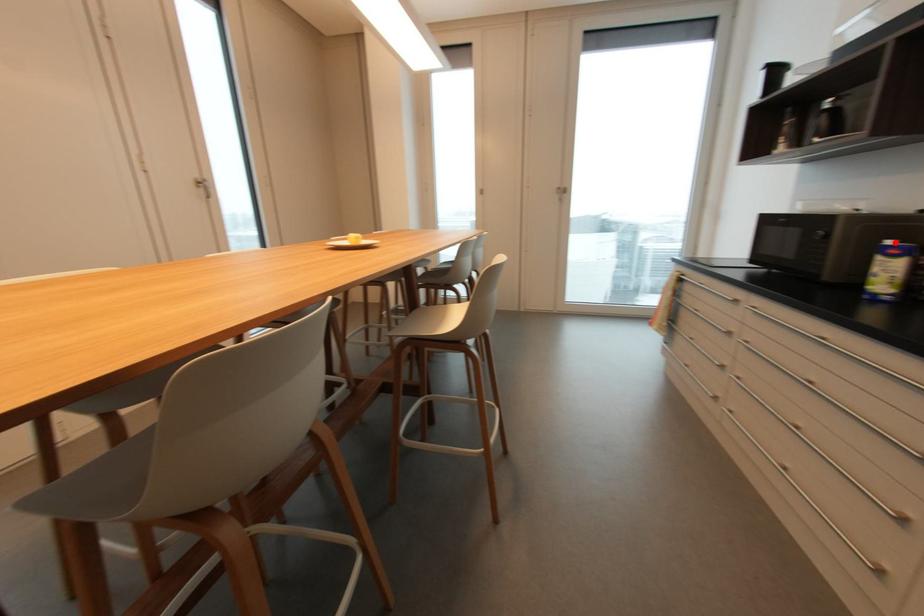
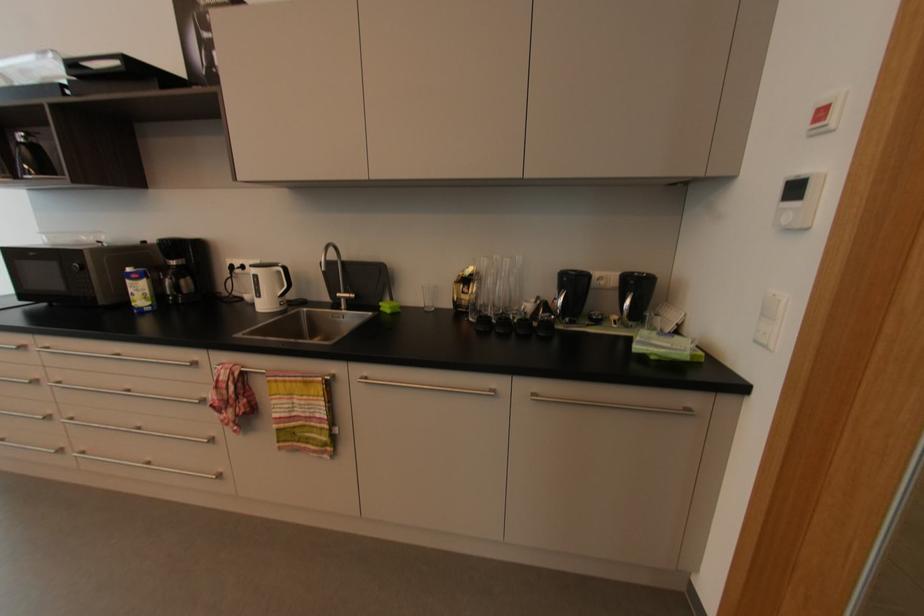
In the second image, find the point that corresponds to the highlighted location in the first image.

(131, 270)